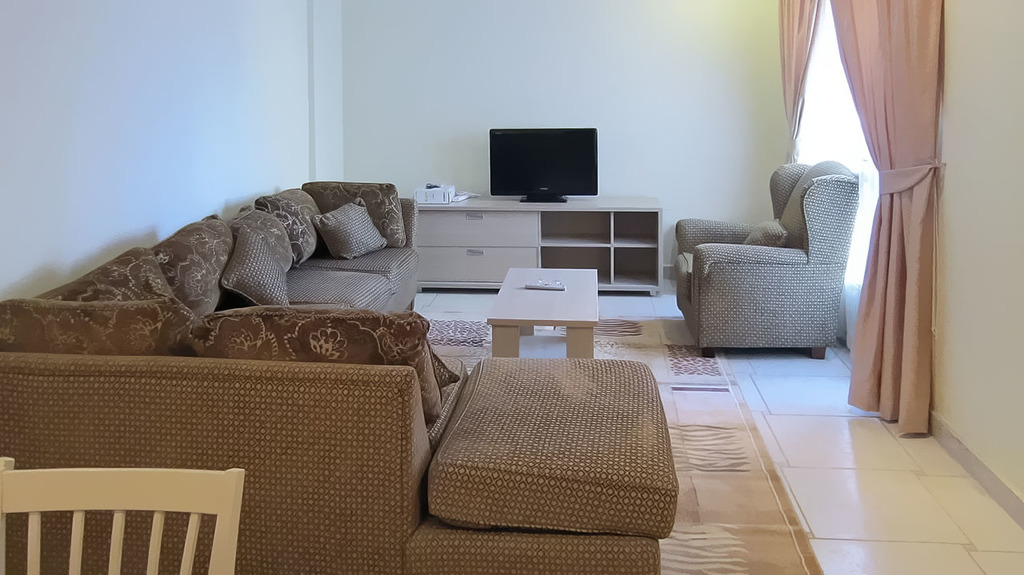
At what (x,y) coordinates should I click in order to perform the action: click on wooden chair. Please return your answer as a coordinate pair (x, y). Looking at the image, I should click on (183, 485).